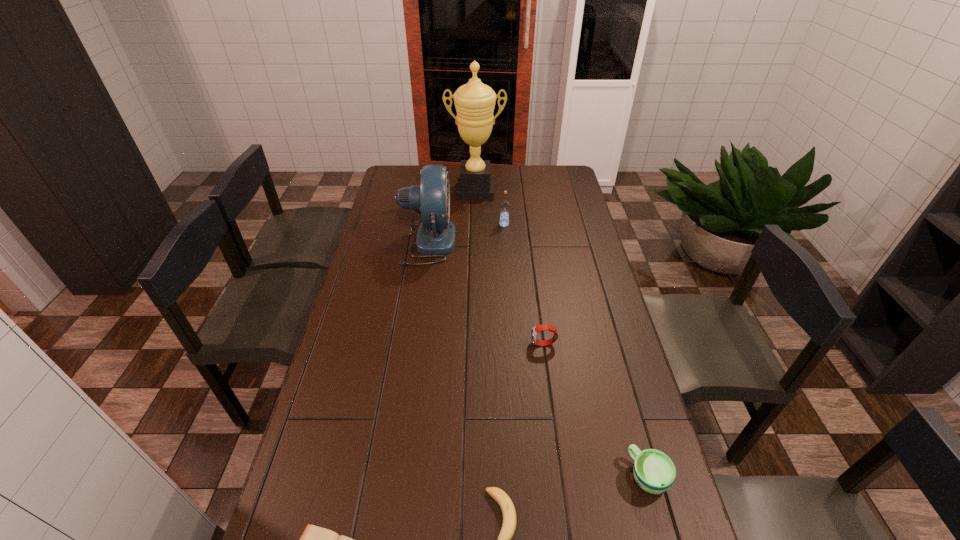
Locate an element on the screen. This screenshot has height=540, width=960. blank area in the image that satisfies the following two spatial constraints: 1. on the front side of the third tallest object; 2. in front of the sixth shortest object to blow air is located at coordinates (505, 242).